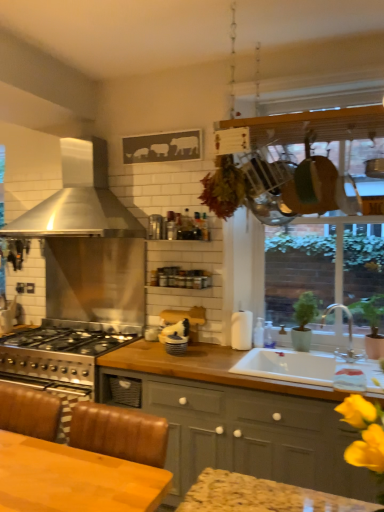
Question: From the image's perspective, is wooden frame at upper right above or below silver metallic faucet at sink right?

Choices:
 (A) above
 (B) below

Answer: (A)

Question: Considering the relative positions of wooden frame at upper right and silver metallic faucet at sink right in the image provided, is wooden frame at upper right to the left or to the right of silver metallic faucet at sink right?

Choices:
 (A) left
 (B) right

Answer: (A)

Question: Estimate the real-world distances between objects in this image. Which object is closer to the wooden table at lower left?

Choices:
 (A) white paper towel dispenser at center, the first appliance when ordered from right to left
 (B) white glossy jar at center, which is the second appliance from left to right
 (C) matte gray cabinets at center
 (D) wooden frame at upper right
 (E) green matte plant at sink, the first plant viewed from the left

Answer: (C)

Question: Which object is positioned closest to the metallic silver spice rack at upper center, which is the first appliance in back-to-front order?

Choices:
 (A) matte gray cabinets at center
 (B) silver metallic faucet at sink right
 (C) stainless steel range hood at left
 (D) wooden table at lower left
 (E) wooden frame at upper right

Answer: (C)